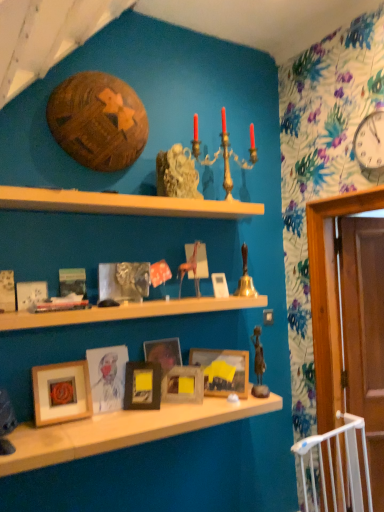
Question: Does gold metallic candelabra at upper center contain bronze statue at center-right?

Choices:
 (A) yes
 (B) no

Answer: (B)

Question: Does gold metallic candelabra at upper center have a smaller size compared to bronze statue at center-right?

Choices:
 (A) no
 (B) yes

Answer: (A)

Question: Is gold metallic candelabra at upper center closer to camera compared to bronze statue at center-right?

Choices:
 (A) no
 (B) yes

Answer: (A)

Question: Are gold metallic candelabra at upper center and bronze statue at center-right located far from each other?

Choices:
 (A) no
 (B) yes

Answer: (B)

Question: Is gold metallic candelabra at upper center looking in the opposite direction of bronze statue at center-right?

Choices:
 (A) no
 (B) yes

Answer: (A)

Question: Does gold metallic candelabra at upper center have a lesser width compared to bronze statue at center-right?

Choices:
 (A) yes
 (B) no

Answer: (A)

Question: Could you tell me if wooden picture frame at center, marked as the 3th picture frame in a right-to-left arrangement, is turned towards white glossy clock at upper right?

Choices:
 (A) no
 (B) yes

Answer: (A)

Question: Does wooden picture frame at center, the fifth picture frame from the left, have a lesser height compared to white glossy clock at upper right?

Choices:
 (A) yes
 (B) no

Answer: (A)

Question: Is wooden picture frame at center, the fifth picture frame from the left, oriented away from white glossy clock at upper right?

Choices:
 (A) no
 (B) yes

Answer: (A)

Question: From a real-world perspective, is wooden picture frame at center, marked as the 3th picture frame in a right-to-left arrangement, located higher than white glossy clock at upper right?

Choices:
 (A) no
 (B) yes

Answer: (A)

Question: Considering the relative positions of wooden picture frame at center, the fifth picture frame from the left, and white glossy clock at upper right in the image provided, is wooden picture frame at center, the fifth picture frame from the left, in front of white glossy clock at upper right?

Choices:
 (A) no
 (B) yes

Answer: (A)

Question: Is wooden picture frame at center, the fifth picture frame from the left, next to white glossy clock at upper right and touching it?

Choices:
 (A) yes
 (B) no

Answer: (B)

Question: Is wooden picture frame at lower left, placed as the 2th picture frame when sorted from left to right, closer to the viewer compared to wooden picture frame at center, marked as the 3th picture frame in a right-to-left arrangement?

Choices:
 (A) yes
 (B) no

Answer: (A)